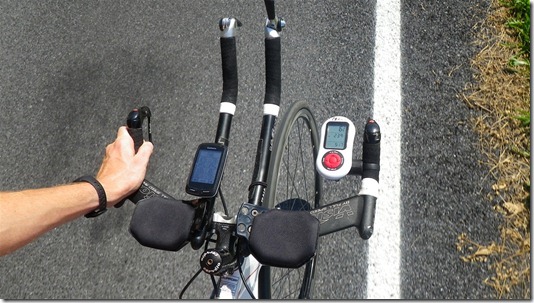
The image size is (534, 303). In order to click on screens in this screenshot , I will do `click(212, 161)`, `click(334, 135)`.